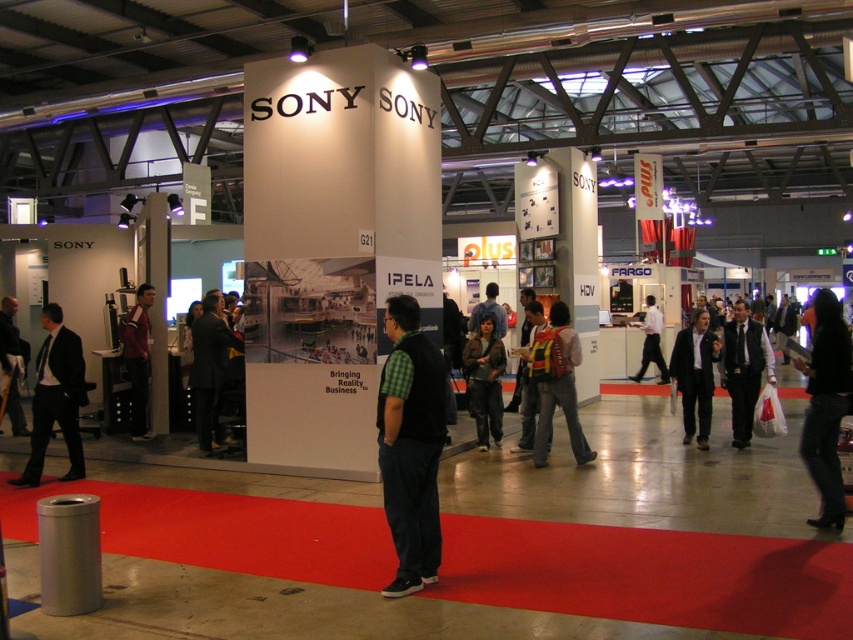
Question: Among these objects, which one is farthest from the camera?

Choices:
 (A) black suit at left
 (B) dark suit at left

Answer: (B)

Question: Based on their relative distances, which object is farther from the matte red jacket at center?

Choices:
 (A) yellow reflective vest at center
 (B) dark suit at left
 (C) black fabric jacket at center
 (D) blue denim jeans at center

Answer: (C)

Question: Among these points, which one is farthest from the camera?

Choices:
 (A) (700, 369)
 (B) (132, 372)
 (C) (540, 310)
 (D) (552, 312)

Answer: (B)

Question: Can you confirm if denim jacket at center is bigger than yellow reflective vest at center?

Choices:
 (A) yes
 (B) no

Answer: (B)

Question: Is matte red jacket at center to the right of black fabric jacket at center from the viewer's perspective?

Choices:
 (A) no
 (B) yes

Answer: (A)

Question: Is dark suit at center smaller than matte black suit at center?

Choices:
 (A) yes
 (B) no

Answer: (B)